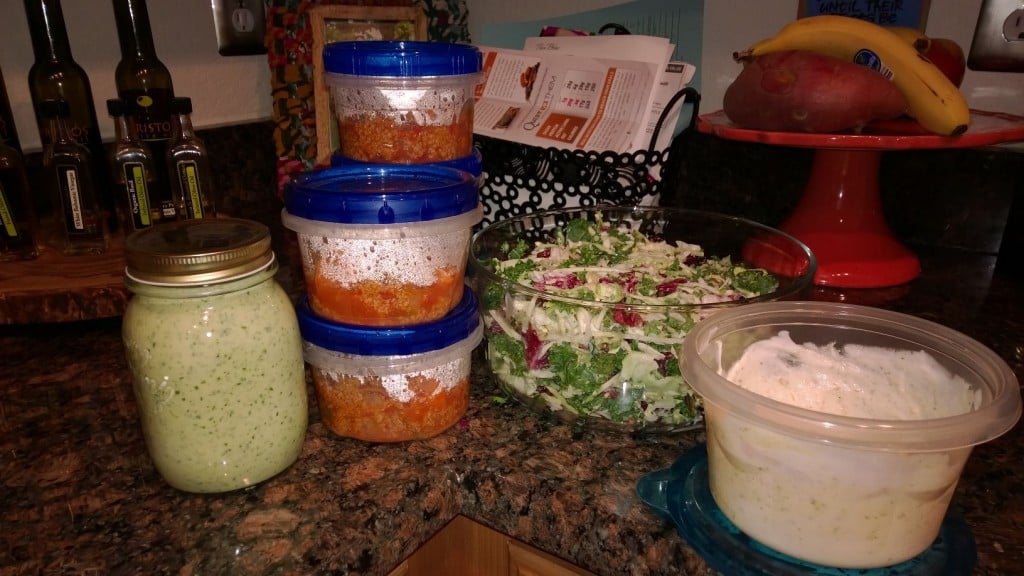
Locate an element on the screen. This screenshot has height=576, width=1024. jar is located at coordinates (225, 352).